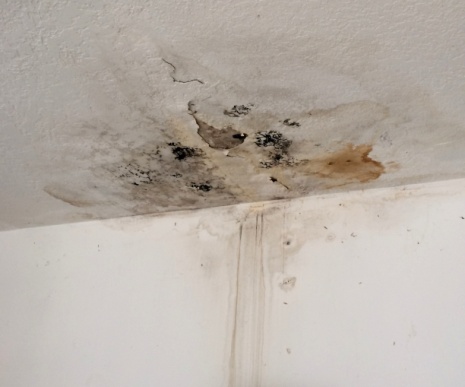
I want to click on ceiling, so click(283, 44).